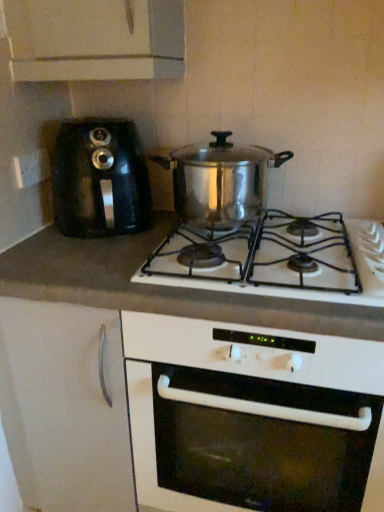
This screenshot has height=512, width=384. Describe the element at coordinates (184, 389) in the screenshot. I see `white matte gas stove at center` at that location.

This screenshot has height=512, width=384. I want to click on black plastic coffee machine at left, so click(x=99, y=179).

Between white plastic socket at left and white matte gas stove at center, which one has less height?

With less height is white plastic socket at left.

From a real-world perspective, is white plastic socket at left located higher than white matte gas stove at center?

Yes, from a real-world perspective, white plastic socket at left is over white matte gas stove at center

Are white plastic socket at left and white matte gas stove at center beside each other?

There is a gap between white plastic socket at left and white matte gas stove at center.

From a real-world perspective, does shiny metallic pot at center sit lower than white matte gas stove at center?

No.

Which is more to the left, shiny metallic pot at center or white matte gas stove at center?

Positioned to the left is shiny metallic pot at center.

Is shiny metallic pot at center facing towards white matte gas stove at center?

No, shiny metallic pot at center does not turn towards white matte gas stove at center.

From the image's perspective, which object appears higher, shiny metallic pot at center or black plastic coffee machine at left?

black plastic coffee machine at left appears higher in the image.

From a real-world perspective, is shiny metallic pot at center physically above black plastic coffee machine at left?

Yes, from a real-world perspective, shiny metallic pot at center is on top of black plastic coffee machine at left.

From the picture: Is shiny metallic pot at center directly adjacent to black plastic coffee machine at left?

No, shiny metallic pot at center is not next to black plastic coffee machine at left.

Which is closer, (123, 297) or (64, 195)?

Positioned in front is point (123, 297).

From a real-world perspective, is white matte gas stove at center positioned under black plastic coffee machine at left based on gravity?

Yes, from a real-world perspective, white matte gas stove at center is below black plastic coffee machine at left.

Based on their positions, is white matte gas stove at center located to the left or right of black plastic coffee machine at left?

white matte gas stove at center is positioned on black plastic coffee machine at left's right side.

How much distance is there between white matte gas stove at center and black plastic coffee machine at left?

white matte gas stove at center and black plastic coffee machine at left are 12.91 inches apart.

Locate an element on the screen. This screenshot has height=512, width=384. electric outlet behind the shiny metallic pot at center is located at coordinates (31, 168).

Considering the relative sizes of white plastic socket at left and shiny metallic pot at center in the image provided, is white plastic socket at left smaller than shiny metallic pot at center?

Yes, white plastic socket at left is smaller than shiny metallic pot at center.

From the picture: Could you tell me if white plastic socket at left is turned towards shiny metallic pot at center?

Yes, white plastic socket at left is aimed at shiny metallic pot at center.

Is black plastic coffee machine at left outside of shiny metallic pot at center?

Yes, black plastic coffee machine at left is outside of shiny metallic pot at center.

Considering the sizes of objects black plastic coffee machine at left and shiny metallic pot at center in the image provided, who is bigger, black plastic coffee machine at left or shiny metallic pot at center?

black plastic coffee machine at left is bigger.

From the picture: From the image's perspective, which object appears higher, black plastic coffee machine at left or shiny metallic pot at center?

black plastic coffee machine at left.

Which is behind, point (71, 187) or point (239, 153)?

Point (239, 153)

From the image's perspective, is white matte gas stove at center on top of shiny metallic pot at center?

Actually, white matte gas stove at center appears below shiny metallic pot at center in the image.

Considering the positions of points (335, 353) and (357, 224), is point (335, 353) closer to camera compared to point (357, 224)?

Yes, it is.

Between white matte gas stove at center and shiny metallic pot at center, which one has smaller width?

shiny metallic pot at center.

Locate an element on the screen. This screenshot has width=384, height=512. counter in front of the white plastic socket at left is located at coordinates (184, 389).

The width and height of the screenshot is (384, 512). I want to click on gas stove lying on the left of white matte gas stove at center, so click(277, 260).

Estimate the real-world distances between objects in this image. Which object is closer to white matte cabinet at lower left, white plastic socket at left or black plastic coffee machine at left?

black plastic coffee machine at left.

Considering their positions, is black plastic coffee machine at left positioned closer to white matte gas stove at center than white matte cabinet at lower left?

white matte cabinet at lower left lies closer to white matte gas stove at center than the other object.

Based on their spatial positions, is white matte gas stove at center or white plastic socket at left further from shiny metallic pot at center?

white plastic socket at left is positioned further to the anchor shiny metallic pot at center.

When comparing their distances from shiny metallic pot at center, does black plastic coffee machine at left or white matte cabinet at lower left seem further?

white matte cabinet at lower left is further to shiny metallic pot at center.

When comparing their distances from black plastic coffee machine at left, does shiny metallic pot at center or white matte gas stove at center seem closer?

white matte gas stove at center lies closer to black plastic coffee machine at left than the other object.

Which object lies further to the anchor point black plastic coffee machine at left, shiny metallic pot at center or white matte gas stove at center?

Based on the image, white matte gas stove at center appears to be further to black plastic coffee machine at left.

When comparing their distances from shiny metallic pot at center, does black plastic coffee machine at left or shiny metallic pot at center seem closer?

The object closer to shiny metallic pot at center is shiny metallic pot at center.

Looking at the image, which one is located further to white matte gas stove at center, shiny metallic pot at center or shiny metallic pot at center?

shiny metallic pot at center lies further to white matte gas stove at center than the other object.

This screenshot has height=512, width=384. I want to click on kitchen appliance situated between black plastic coffee machine at left and shiny metallic pot at center from left to right, so click(x=221, y=179).

Find the location of a particular element. The image size is (384, 512). gas stove between white plastic socket at left and white matte gas stove at center in the horizontal direction is located at coordinates (277, 260).

This screenshot has height=512, width=384. I want to click on kitchen appliance between black plastic coffee machine at left and white matte cabinet at lower left in the vertical direction, so click(221, 179).

At what (x,y) coordinates should I click in order to perform the action: click on kitchen appliance between black plastic coffee machine at left and white matte gas stove at center in the vertical direction. Please return your answer as a coordinate pair (x, y). This screenshot has width=384, height=512. Looking at the image, I should click on (221, 179).